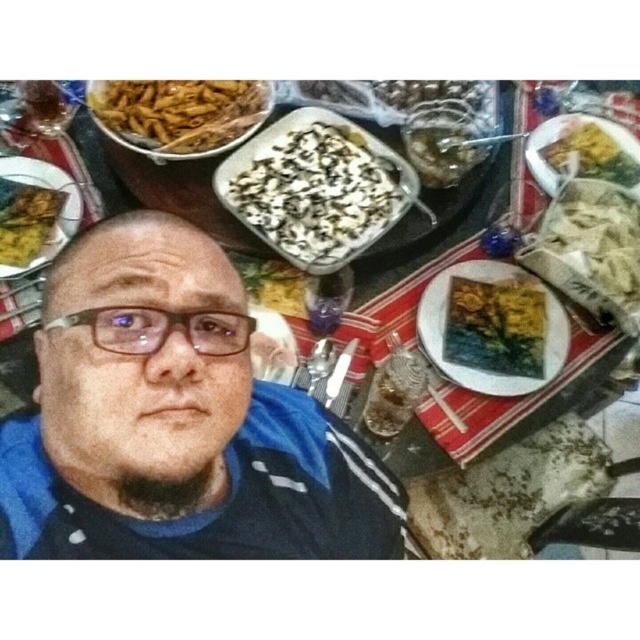
Between point (282, 196) and point (456, 122), which one is positioned behind?

Point (456, 122)

In the scene shown: Does white creamy casserole at center appear on the right side of slightly translucent glass bowl at center?

In fact, white creamy casserole at center is to the left of slightly translucent glass bowl at center.

Identify the location of white creamy casserole at center. (314, 189).

Find the location of a particular element. This screenshot has width=640, height=640. white creamy casserole at center is located at coordinates (314, 189).

Is blue fabric shirt at center positioned in front of white creamy casserole at center?

Yes, it is.

Can you confirm if blue fabric shirt at center is positioned below white creamy casserole at center?

Yes, blue fabric shirt at center is below white creamy casserole at center.

Is point (51, 397) positioned after point (324, 227)?

No.

Find the location of `blue fabric shirt at center`. blue fabric shirt at center is located at coordinates (176, 420).

Does white matte noodles at right have a greater width compared to yellow matte plate at upper left?

Correct, the width of white matte noodles at right exceeds that of yellow matte plate at upper left.

Looking at this image, does white matte noodles at right come in front of yellow matte plate at upper left?

Yes, it is in front of yellow matte plate at upper left.

Which is behind, point (637, 300) or point (67, 237)?

Point (67, 237)

Identify the location of white matte noodles at right. (593, 246).